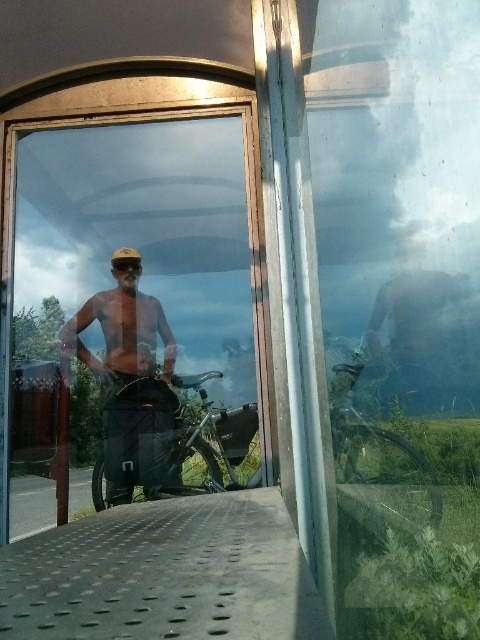
Question: Can you confirm if transparent glass door at center is bigger than matte black goggles at center?

Choices:
 (A) no
 (B) yes

Answer: (B)

Question: Which point is farther to the camera?

Choices:
 (A) (120, 138)
 (B) (109, 460)
 (C) (118, 278)

Answer: (C)

Question: Can you confirm if matte black bicycle at center is positioned below matte black goggles at center?

Choices:
 (A) no
 (B) yes

Answer: (B)

Question: Which is nearer to the shiny metallic helmet at center?

Choices:
 (A) matte black goggles at center
 (B) matte black bicycle at center
 (C) transparent glass door at center

Answer: (B)

Question: Which object is positioned closest to the matte black goggles at center?

Choices:
 (A) transparent glass door at center
 (B) shiny metallic helmet at center
 (C) matte black bicycle at center

Answer: (B)

Question: Is shiny metallic helmet at center positioned in front of matte black goggles at center?

Choices:
 (A) yes
 (B) no

Answer: (A)